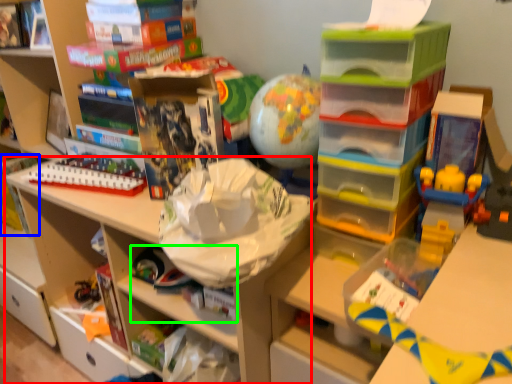
Question: Estimate the real-world distances between objects in this image. Which object is closer to shelf (highlighted by a red box), book (highlighted by a blue box) or book (highlighted by a green box)?

Choices:
 (A) book
 (B) book

Answer: (B)